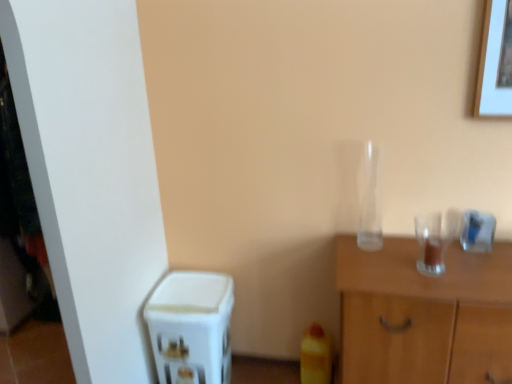
At what (x,y) coordinates should I click in order to perform the action: click on space that is in front of transparent glass vase at center-right. Please return your answer as a coordinate pair (x, y). Looking at the image, I should click on (375, 258).